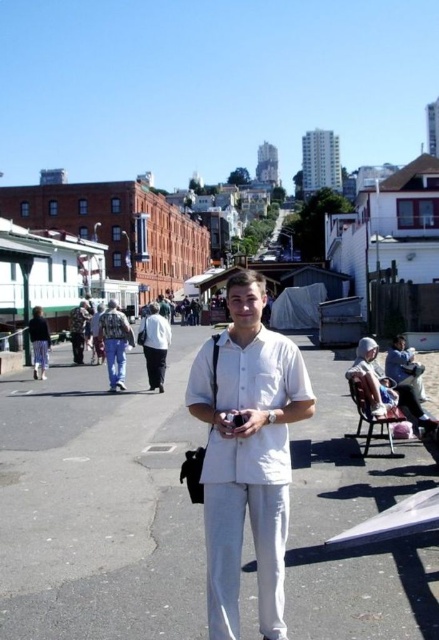
Which is in front, point (148, 317) or point (35, 330)?

Positioned in front is point (148, 317).

Is point (157, 371) positioned before point (46, 344)?

Yes.

At what (x,y) coordinates should I click in order to perform the action: click on white cotton pants at center. Please return your answer as a coordinate pair (x, y). The image size is (439, 640). Looking at the image, I should click on pos(154,346).

Can you confirm if white asphalt at center is smaller than white cotton pants at center?

Yes, white asphalt at center is smaller than white cotton pants at center.

Can you confirm if white asphalt at center is positioned to the right of white cotton pants at center?

Correct, you'll find white asphalt at center to the right of white cotton pants at center.

Does point (24, 509) come closer to viewer compared to point (158, 387)?

Yes, point (24, 509) is closer to viewer.

Where is `white asphalt at center`? Image resolution: width=439 pixels, height=640 pixels. white asphalt at center is located at coordinates (100, 506).

Between matte white hat at lower right and white cotton pants at center, which one has more height?

Standing taller between the two is white cotton pants at center.

Does matte white hat at lower right lie in front of white cotton pants at center?

Yes, matte white hat at lower right is closer to the viewer.

This screenshot has width=439, height=640. Find the location of `matte white hat at lower right`. matte white hat at lower right is located at coordinates (385, 388).

The image size is (439, 640). What are the coordinates of `matte white hat at lower right` in the screenshot? It's located at (385, 388).